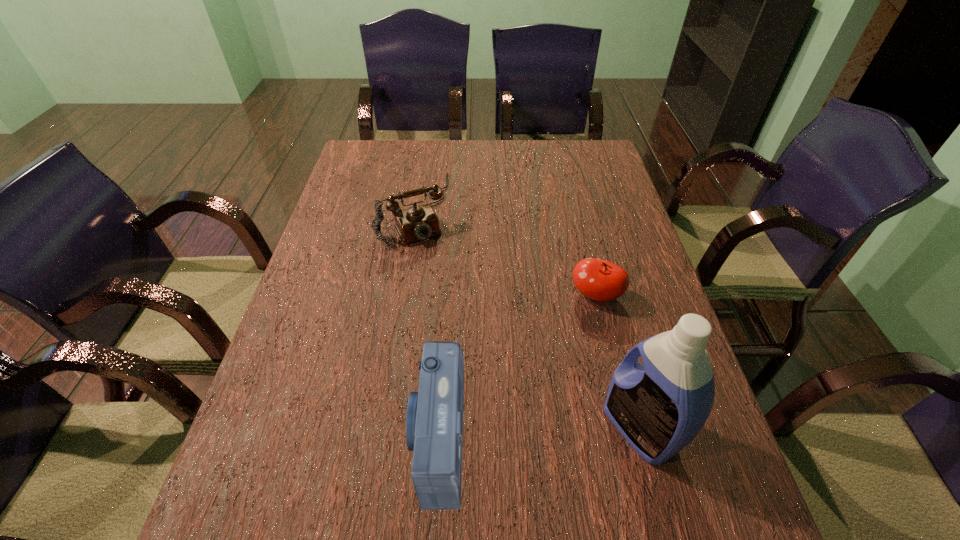
Find the location of a particular element. free spot located 0.330m on the stem of the apple is located at coordinates (518, 416).

You are a GUI agent. You are given a task and a screenshot of the screen. Output one action in this format:
    pyautogui.click(x=<x>, y=<y>)
    Task: Click on the vacant area situated on the dial of the farthest object
    
    Given the screenshot: What is the action you would take?
    pyautogui.click(x=445, y=289)

I want to click on vacant area located 0.090m on the dial of the farthest object, so click(433, 267).

Identify the location of free space located on the dial of the farthest object. The height and width of the screenshot is (540, 960). (447, 292).

The height and width of the screenshot is (540, 960). I want to click on object that is at the far edge, so click(416, 223).

Where is `camera positioned at the near edge`? The image size is (960, 540). camera positioned at the near edge is located at coordinates 434,421.

Locate an element on the screen. This screenshot has width=960, height=540. detergent that is at the near edge is located at coordinates (659, 407).

Image resolution: width=960 pixels, height=540 pixels. I want to click on object that is at the left edge, so click(416, 223).

This screenshot has width=960, height=540. What are the coordinates of `detergent at the right edge` in the screenshot? It's located at (659, 407).

Locate an element on the screen. Image resolution: width=960 pixels, height=540 pixels. apple present at the right edge is located at coordinates (600, 280).